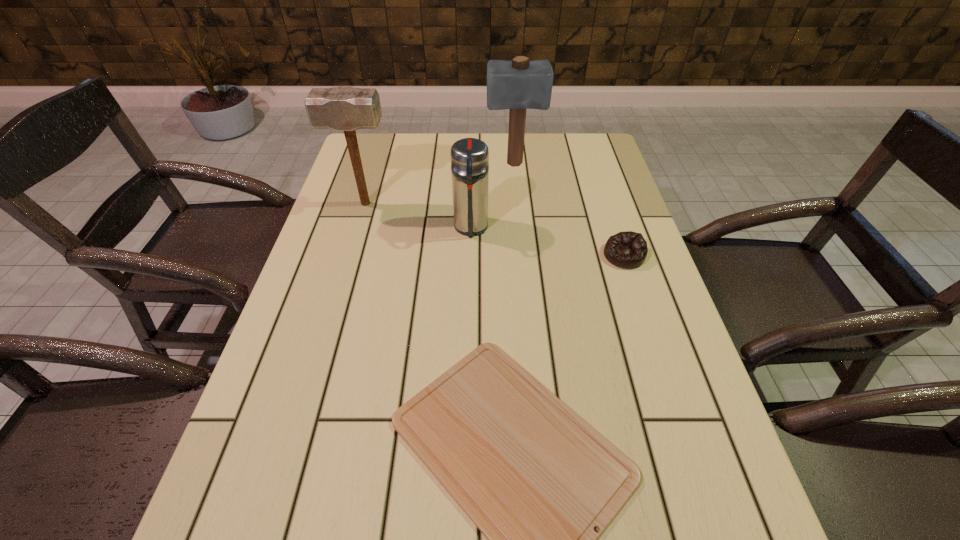
I want to click on vacant space located 0.340m on the front of the beanbag, so click(x=671, y=398).

Locate an element on the screen. The height and width of the screenshot is (540, 960). object at the far edge is located at coordinates (520, 84).

At what (x,y) coordinates should I click in order to perform the action: click on object that is at the left edge. Please return your answer as a coordinate pair (x, y). This screenshot has width=960, height=540. Looking at the image, I should click on (344, 108).

Identify the location of object that is positioned at the right edge. This screenshot has height=540, width=960. (628, 249).

The width and height of the screenshot is (960, 540). In the image, there is a desktop. Find the location of `vacant space at the left edge`. vacant space at the left edge is located at coordinates (324, 241).

In the image, there is a desktop. Identify the location of vacant space at the right edge. Image resolution: width=960 pixels, height=540 pixels. (621, 300).

Where is `vacant region at the far left corner`? The width and height of the screenshot is (960, 540). vacant region at the far left corner is located at coordinates pyautogui.click(x=378, y=145).

Where is `free spot at the far right corner of the desktop`? Image resolution: width=960 pixels, height=540 pixels. free spot at the far right corner of the desktop is located at coordinates tap(577, 134).

Locate an element on the screen. empty space between the rightmost object and the farthest object is located at coordinates (568, 210).

Where is `vacant area that lies between the thermos bottle and the second farthest object`? vacant area that lies between the thermos bottle and the second farthest object is located at coordinates (419, 215).